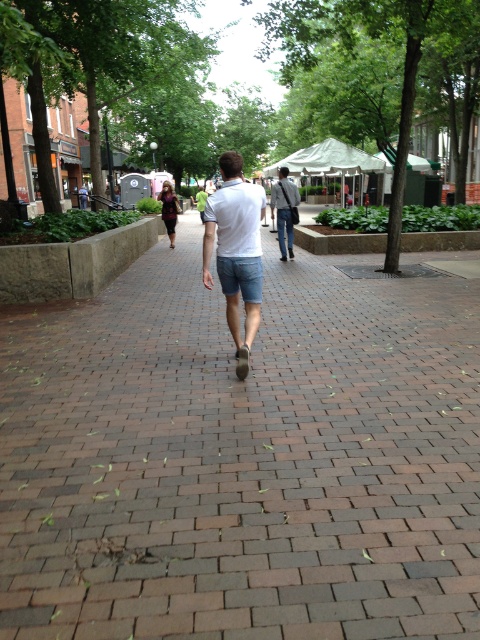
You are standing at the edge of the brick pavement at center and want to take a photo of the white cotton shirt at center. Which object is closer to the camera, and why?

The brick pavement at center is closer to the camera because it is taller than the white cotton shirt at center.

What is the exact coordinate of the brick pavement at center?

The brick pavement at center is located at coordinate point (241,458).